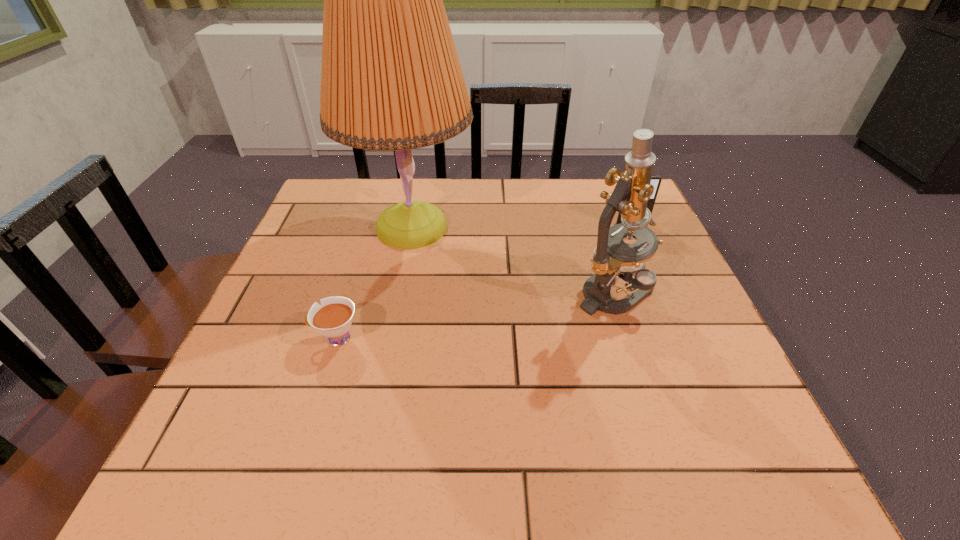
You are a GUI agent. You are given a task and a screenshot of the screen. Output one action in this format:
    pyautogui.click(x=<x>, y=<y>)
    Task: Click on the vacant space positioned 0.070m on the side of the teacup with the handle
    
    Given the screenshot: What is the action you would take?
    (x=276, y=338)

Identify the location of lamp that is at the far edge. (391, 80).

This screenshot has height=540, width=960. What are the coordinates of `iPod that is at the far edge` in the screenshot? It's located at (656, 180).

Find the location of `lamp that is positioned at the left edge`. lamp that is positioned at the left edge is located at coordinates (391, 80).

The image size is (960, 540). I want to click on teacup that is at the left edge, so click(x=333, y=318).

The image size is (960, 540). I want to click on microscope present at the right edge, so click(612, 256).

Where is `iPod located at the right edge`? iPod located at the right edge is located at coordinates (656, 180).

At what (x,y) coordinates should I click in order to perform the action: click on object that is at the far left corner. Please return your answer as a coordinate pair (x, y). The image size is (960, 540). Looking at the image, I should click on (391, 80).

I want to click on object present at the far right corner, so click(x=656, y=180).

Where is `blank space at the far edge of the desktop`? The height and width of the screenshot is (540, 960). blank space at the far edge of the desktop is located at coordinates (489, 214).